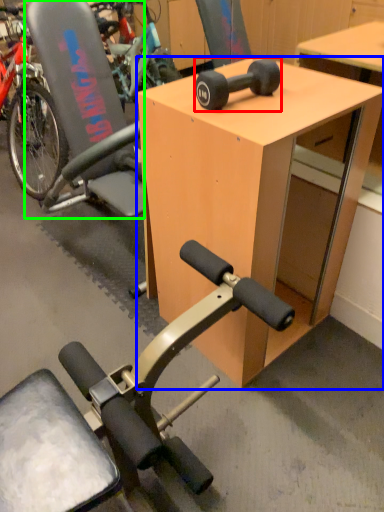
Question: Which is nearer to the wheel (highlighted by a red box)? desk (highlighted by a blue box) or swivel chair (highlighted by a green box).

Choices:
 (A) desk
 (B) swivel chair

Answer: (A)